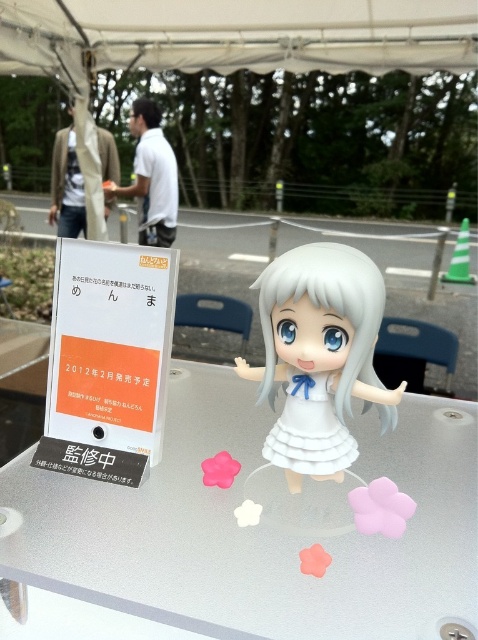
Does point (289, 513) come in front of point (271, 452)?

Yes, point (289, 513) is in front of point (271, 452).

Who is positioned more to the right, transparent acrylic table at center or white matte dress at center?

Positioned to the right is white matte dress at center.

This screenshot has height=640, width=478. Describe the element at coordinates (259, 525) in the screenshot. I see `transparent acrylic table at center` at that location.

Identify the location of transparent acrylic table at center. (259, 525).

Between transparent acrylic table at center and white fabric canopy at upper center, which one appears on the left side from the viewer's perspective?

Positioned to the left is white fabric canopy at upper center.

Does transparent acrylic table at center have a lesser width compared to white fabric canopy at upper center?

Yes, transparent acrylic table at center is thinner than white fabric canopy at upper center.

Which is in front, point (354, 556) or point (80, 28)?

Point (354, 556)

This screenshot has height=640, width=478. What are the coordinates of `transparent acrylic table at center` in the screenshot? It's located at (259, 525).

Does white glossy doll at center appear over white matte dress at center?

Correct, white glossy doll at center is located above white matte dress at center.

Is point (304, 246) closer to viewer compared to point (322, 404)?

Yes, it is.

You are a GUI agent. You are given a task and a screenshot of the screen. Output one action in this format:
    pyautogui.click(x=<x>, y=<y>)
    Task: Click on the white glossy doll at center
    The width and height of the screenshot is (478, 640).
    Given the screenshot: What is the action you would take?
    pyautogui.click(x=317, y=355)